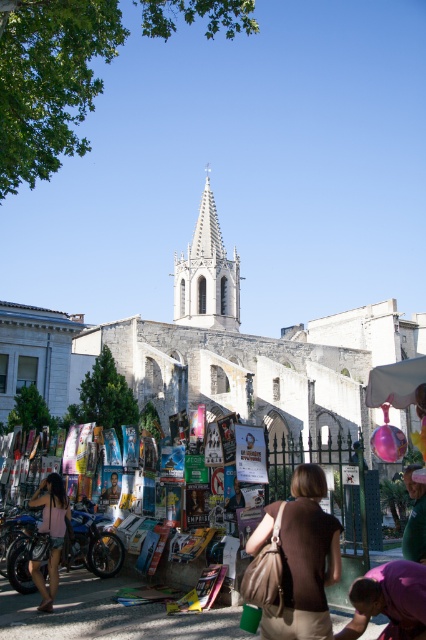
Question: Does white stone spire at center lie in front of blue metallic motorcycle at lower left?

Choices:
 (A) no
 (B) yes

Answer: (A)

Question: Does brown fabric bag at center appear on the right side of white stone spire at center?

Choices:
 (A) no
 (B) yes

Answer: (B)

Question: Considering the real-world distances, which object is closest to the brown fabric bag at center?

Choices:
 (A) white stone church at center
 (B) white stone spire at center
 (C) matte pink dress at lower left
 (D) blue metallic motorcycle at lower left

Answer: (D)

Question: Is brown fabric bag at center behind blue metallic motorcycle at lower left?

Choices:
 (A) no
 (B) yes

Answer: (A)

Question: Which of the following is the farthest from the observer?

Choices:
 (A) matte pink dress at lower left
 (B) blue metallic motorcycle at lower left
 (C) white stone church at center
 (D) white stone spire at center

Answer: (D)

Question: Which point is farther to the camera?

Choices:
 (A) blue metallic motorcycle at lower left
 (B) white stone spire at center

Answer: (B)